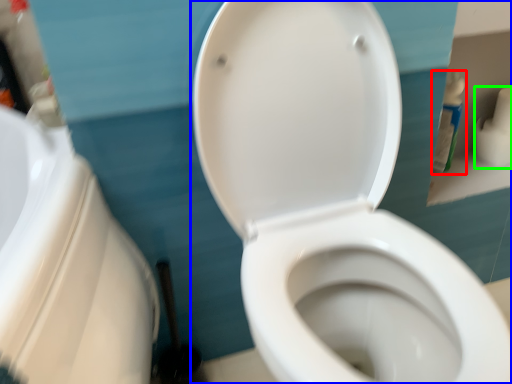
Question: Based on their relative distances, which object is farther from cleaning product (highlighted by a red box)? Choose from toilet (highlighted by a blue box) and toilet paper (highlighted by a green box).

Choices:
 (A) toilet
 (B) toilet paper

Answer: (A)